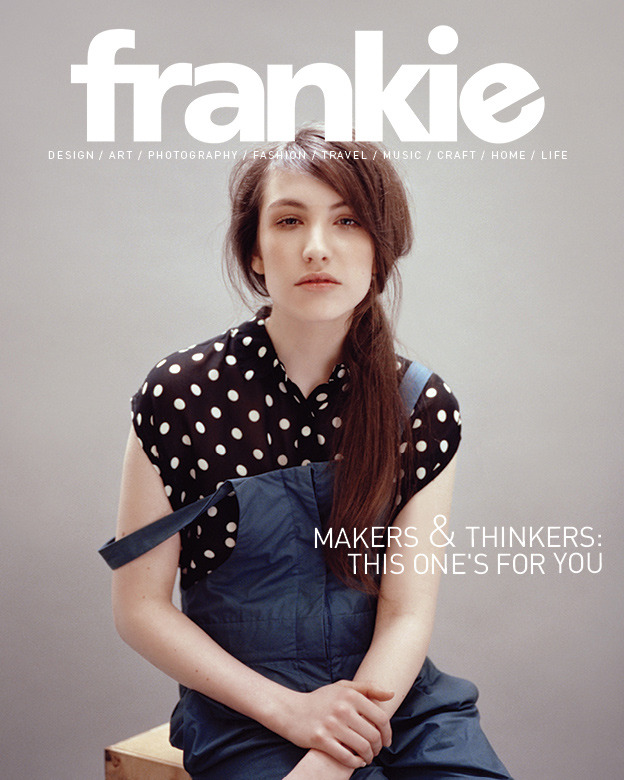
Find the location of a particular element. The width and height of the screenshot is (624, 780). wall is located at coordinates (477, 178).